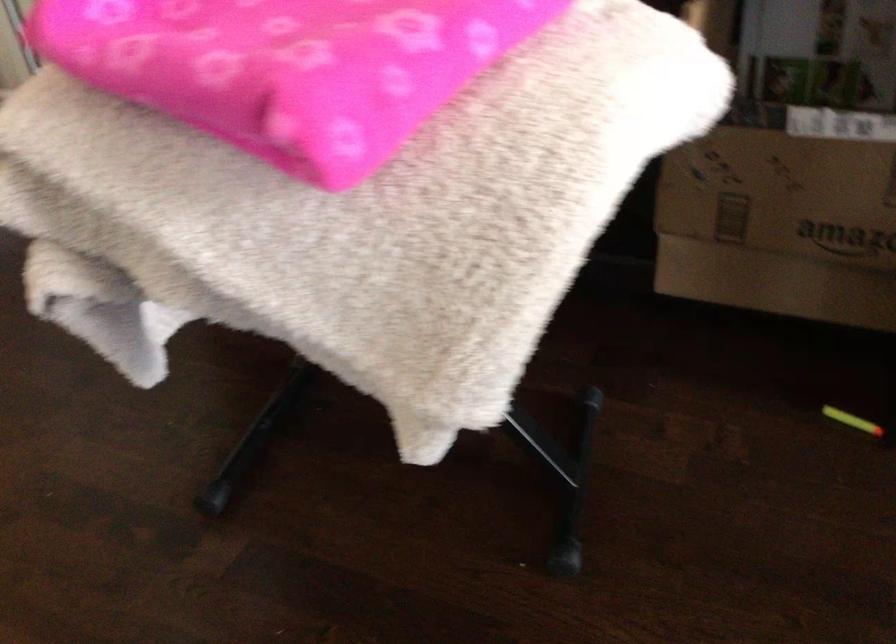
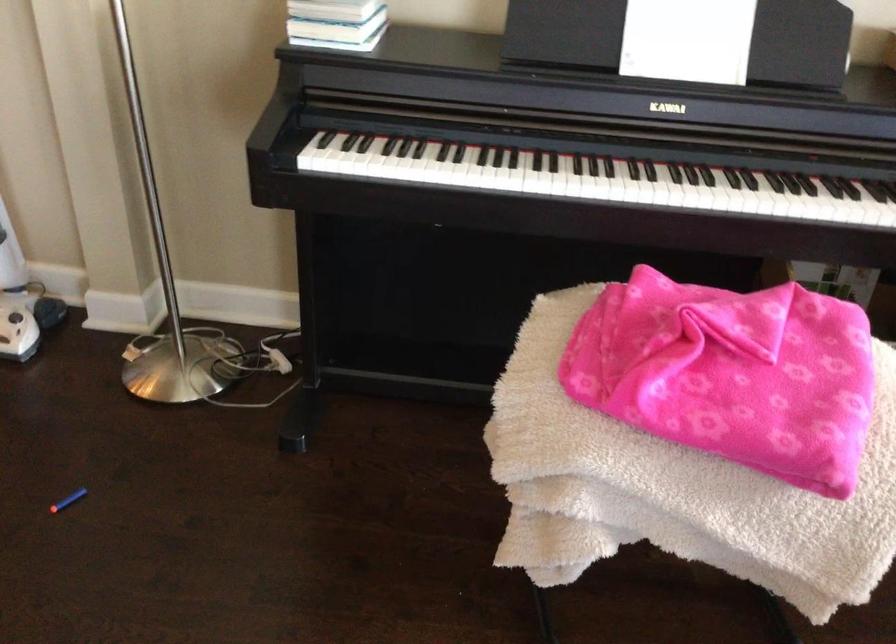
Question: The images are taken continuously from a first-person perspective. In which direction is your viewpoint rotating?

Choices:
 (A) Left
 (B) Right
 (C) Up
 (D) Down

Answer: (B)